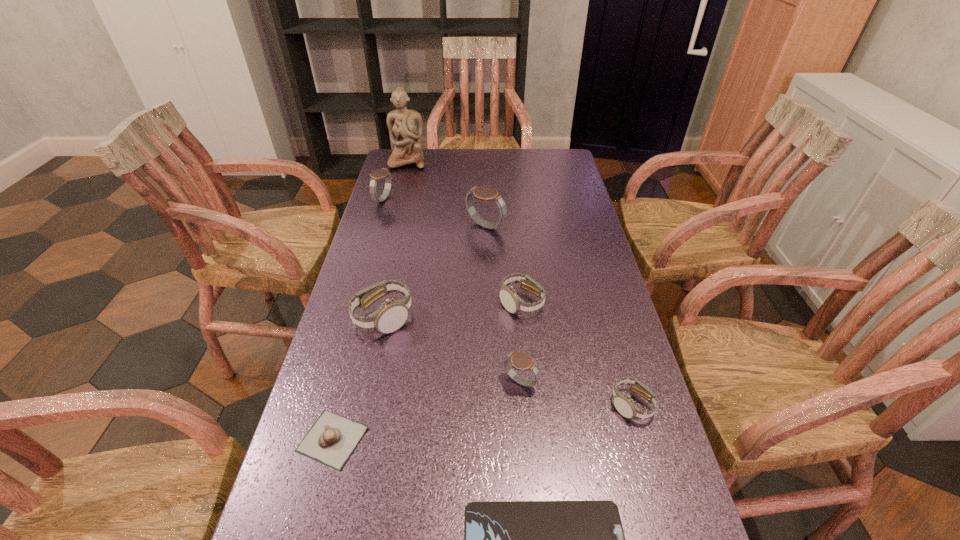
Where is `gray watch identified as the third closest to the biggest white watch`? This screenshot has width=960, height=540. gray watch identified as the third closest to the biggest white watch is located at coordinates (413, 539).

Identify the location of white watch that is the second closest to the second shortest object. (413, 539).

Find the location of a particular element. The image size is (960, 540). the third closest white watch to the tallest object is located at coordinates (413, 539).